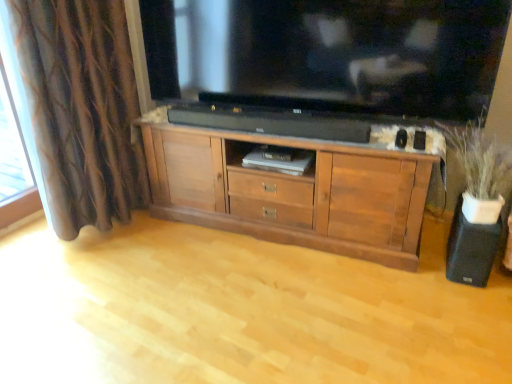
Image resolution: width=512 pixels, height=384 pixels. Describe the element at coordinates (292, 192) in the screenshot. I see `brown wood cabinet at center` at that location.

Measure the distance between black glossy television at upper center and camera.

The depth of black glossy television at upper center is 5.50 feet.

What are the coordinates of `wooden cabinet at center` in the screenshot? It's located at (239, 311).

This screenshot has height=384, width=512. What do you see at coordinates (81, 110) in the screenshot?
I see `brown textured curtain at left` at bounding box center [81, 110].

The image size is (512, 384). Identify the location of brown wood cabinet at center. (292, 192).

Does point (108, 253) come in front of point (502, 168)?

No, (108, 253) is behind (502, 168).

Based on the photo, from the image's perspective, relative to white matte vase at right, is wooden cabinet at center above or below?

wooden cabinet at center is below white matte vase at right.

Considering the relative positions of wooden cabinet at center and white matte vase at right in the image provided, is wooden cabinet at center to the right of white matte vase at right from the viewer's perspective?

No, wooden cabinet at center is not to the right of white matte vase at right.

Identify the location of plant that is on the right side of wooden cabinet at center. Image resolution: width=512 pixels, height=384 pixels. (479, 160).

In order to click on curtain on the left of black glossy television at upper center in this screenshot , I will do `click(81, 110)`.

Is brown textured curtain at left at the back of black glossy television at upper center?

black glossy television at upper center is not turned away from brown textured curtain at left.

Is black glossy television at upper center taller or shorter than brown textured curtain at left?

Considering their sizes, black glossy television at upper center has less height than brown textured curtain at left.

Is black glossy television at upper center in contact with brown textured curtain at left?

No.

From a real-world perspective, which is physically below, brown wood cabinet at center or wooden cabinet at center?

In real-world perspective, wooden cabinet at center is lower.

From the image's perspective, which is above, brown wood cabinet at center or wooden cabinet at center?

brown wood cabinet at center is shown above in the image.

Is wooden cabinet at center a part of brown wood cabinet at center?

No, wooden cabinet at center is located outside of brown wood cabinet at center.

Which of these two, brown wood cabinet at center or wooden cabinet at center, is bigger?

brown wood cabinet at center.

Looking at the image, does white matte vase at right seem bigger or smaller compared to black glossy television at upper center?

Considering their sizes, white matte vase at right takes up less space than black glossy television at upper center.

Would you say black glossy television at upper center is part of white matte vase at right's contents?

No, black glossy television at upper center is not inside white matte vase at right.

From a real-world perspective, is white matte vase at right under black glossy television at upper center?

Yes, from a real-world perspective, white matte vase at right is below black glossy television at upper center.

How different are the orientations of white matte vase at right and black glossy television at upper center in degrees?

white matte vase at right and black glossy television at upper center are facing 2.59 degrees away from each other.

Could you tell me if brown textured curtain at left is facing wooden cabinet at center?

Yes, brown textured curtain at left faces towards wooden cabinet at center.

You are a GUI agent. You are given a task and a screenshot of the screen. Output one action in this format:
    pyautogui.click(x=<x>, y=<y>)
    Task: Click on the plain in front of the brown textured curtain at left
    Image resolution: width=512 pixels, height=384 pixels.
    Given the screenshot: What is the action you would take?
    pyautogui.click(x=239, y=311)

From a real-world perspective, is brown textured curtain at left positioned over wooden cabinet at center based on gravity?

Yes, from a real-world perspective, brown textured curtain at left is on top of wooden cabinet at center.

Can you confirm if brown textured curtain at left is shorter than wooden cabinet at center?

In fact, brown textured curtain at left may be taller than wooden cabinet at center.

In terms of width, does black matte speaker at lower right look wider or thinner when compared to brown wood cabinet at center?

black matte speaker at lower right is thinner than brown wood cabinet at center.

From a real-world perspective, which is physically above, black matte speaker at lower right or brown wood cabinet at center?

In real-world perspective, brown wood cabinet at center is above.

Is black matte speaker at lower right oriented towards brown wood cabinet at center?

No, black matte speaker at lower right is not aimed at brown wood cabinet at center.

Consider the image. Would you say wooden cabinet at center is outside black matte speaker at lower right?

Yes.

Which of these two, wooden cabinet at center or black matte speaker at lower right, is bigger?

With larger size is wooden cabinet at center.

Are wooden cabinet at center and black matte speaker at lower right making contact?

No, wooden cabinet at center is not making contact with black matte speaker at lower right.

The width and height of the screenshot is (512, 384). I want to click on plain below the white matte vase at right (from the image's perspective), so click(239, 311).

The height and width of the screenshot is (384, 512). In order to click on curtain that is in front of the black glossy television at upper center in this screenshot , I will do click(81, 110).

Estimate the real-world distances between objects in this image. Which object is further from white matte vase at right, wooden cabinet at center or black matte speaker at lower right?

Based on the image, wooden cabinet at center appears to be further to white matte vase at right.

Considering their positions, is brown wood cabinet at center positioned closer to wooden cabinet at center than black matte speaker at lower right?

brown wood cabinet at center lies closer to wooden cabinet at center than the other object.

Based on their spatial positions, is white matte vase at right or wooden cabinet at center further from brown wood cabinet at center?

white matte vase at right.

Based on their spatial positions, is black glossy television at upper center or black matte speaker at lower right further from brown wood cabinet at center?

black matte speaker at lower right.

Looking at the image, which one is located further to wooden cabinet at center, black glossy television at upper center or black matte speaker at lower right?

black glossy television at upper center is further to wooden cabinet at center.

Considering their positions, is brown textured curtain at left positioned further to brown wood cabinet at center than black glossy television at upper center?

brown textured curtain at left lies further to brown wood cabinet at center than the other object.

Consider the image. Considering their positions, is wooden cabinet at center positioned closer to white matte vase at right than black glossy television at upper center?

Based on the image, black glossy television at upper center appears to be nearer to white matte vase at right.

In the scene shown: When comparing their distances from black matte speaker at lower right, does brown wood cabinet at center or white matte vase at right seem closer?

Among the two, white matte vase at right is located nearer to black matte speaker at lower right.

In order to click on television between brown textured curtain at left and white matte vase at right in the horizontal direction in this screenshot , I will do `click(329, 54)`.

The width and height of the screenshot is (512, 384). Identify the location of television between brown textured curtain at left and black matte speaker at lower right in the horizontal direction. coord(329,54).

What are the coordinates of `plain situated between brown textured curtain at left and black matte speaker at lower right from left to right` in the screenshot? It's located at (239, 311).

The width and height of the screenshot is (512, 384). I want to click on cabinetry located between brown textured curtain at left and black glossy television at upper center in the left-right direction, so click(292, 192).